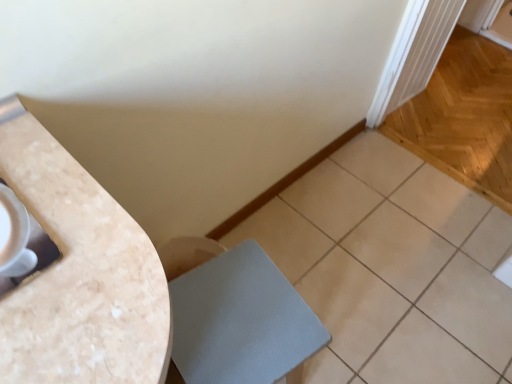
You are a GUI agent. You are given a task and a screenshot of the screen. Output one action in this format:
    pyautogui.click(x=<x>, y=<y>)
    Task: Click on the gray matte stool at lower center
    This screenshot has height=384, width=512.
    Given the screenshot: What is the action you would take?
    pyautogui.click(x=240, y=320)

Describe the element at coordinates (240, 320) in the screenshot. I see `gray matte stool at lower center` at that location.

Measure the distance between gray matte stool at lower center and camera.

gray matte stool at lower center is 81.18 centimeters away from camera.

This screenshot has height=384, width=512. I want to click on gray matte stool at lower center, so click(x=240, y=320).